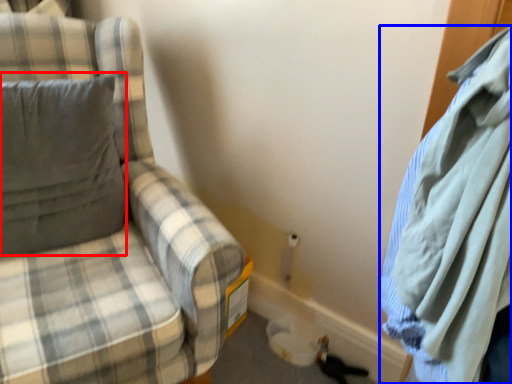
Question: Which object appears closest to the camera in this image, pillow (highlighted by a red box) or cloak (highlighted by a blue box)?

Choices:
 (A) pillow
 (B) cloak

Answer: (B)